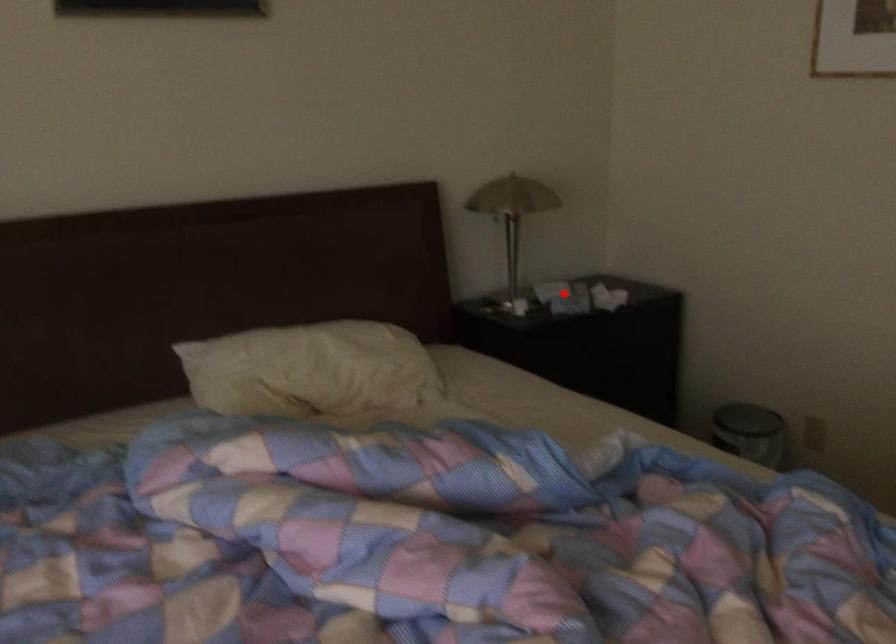
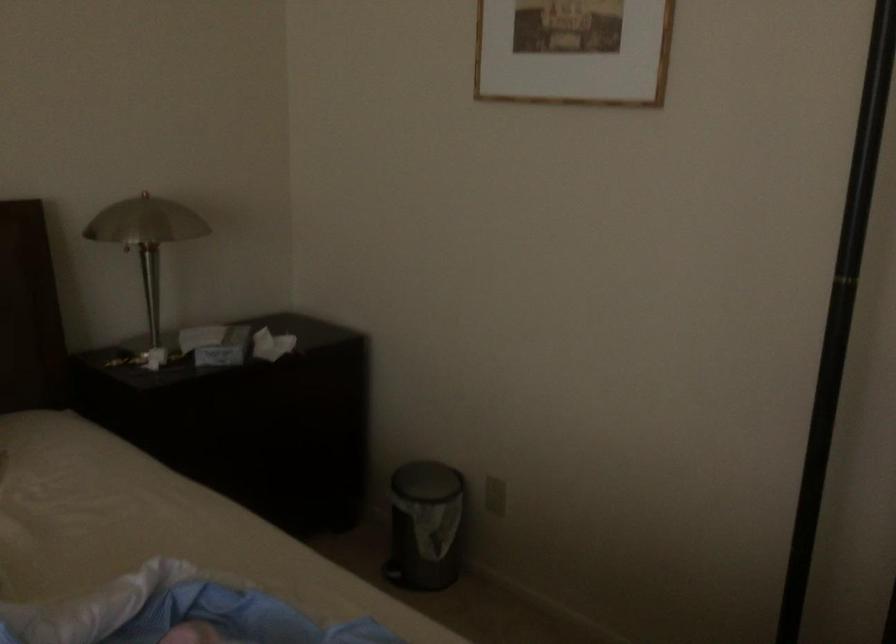
In the second image, find the point that corresponds to the highlighted location in the first image.

(216, 344)